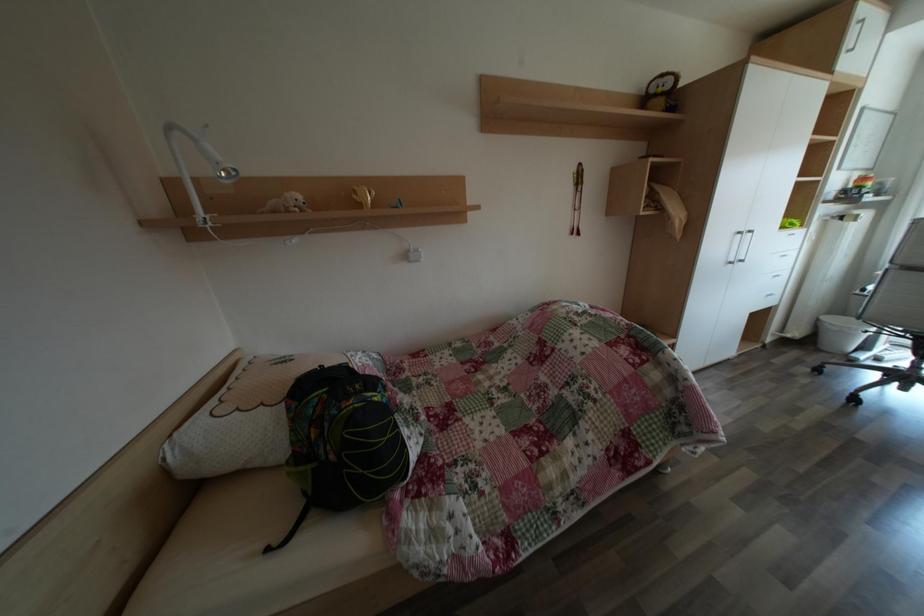
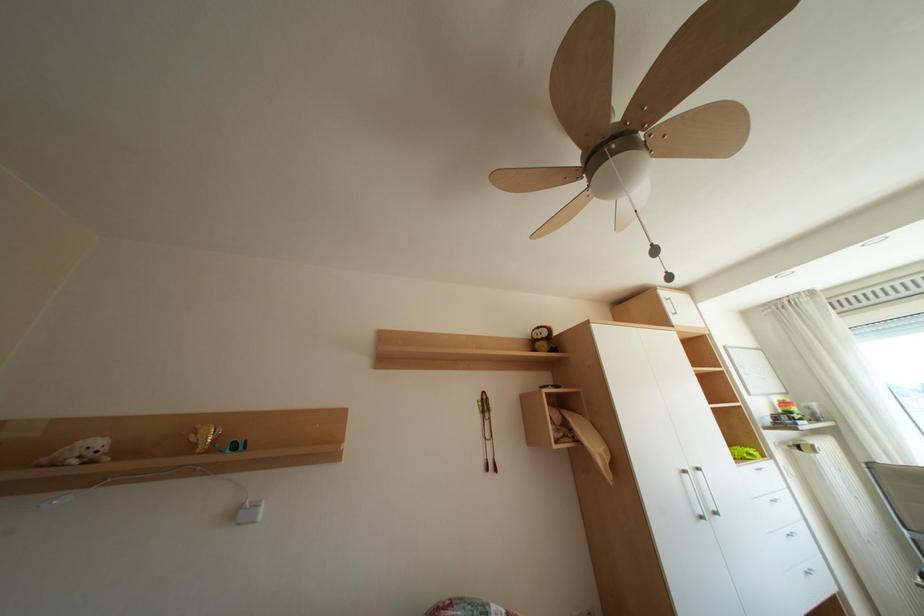
Question: The first image is from the beginning of the video and the second image is from the end. How did the camera likely rotate when shooting the video?

Choices:
 (A) Left
 (B) Right
 (C) Up
 (D) Down

Answer: (C)